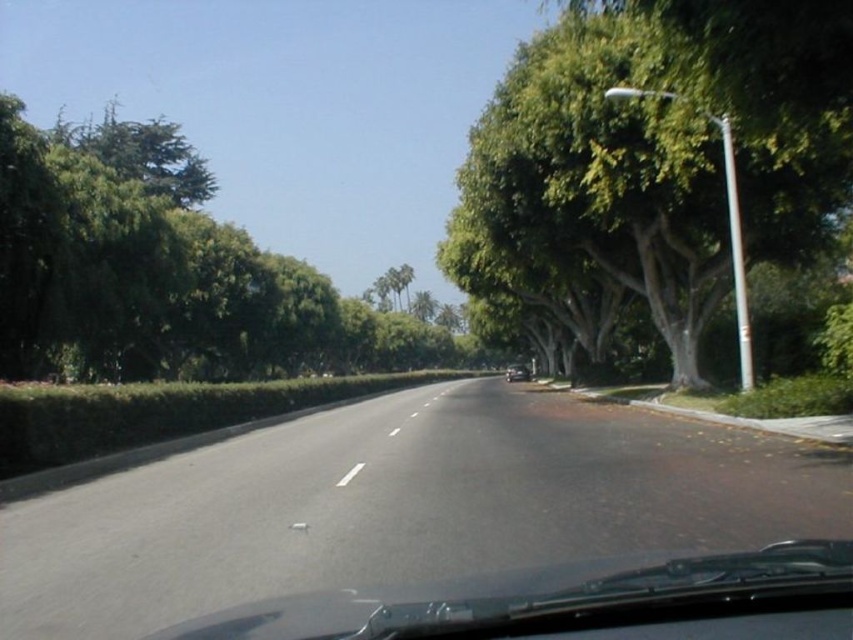
Question: Which point is farther to the camera?

Choices:
 (A) shiny silver car at center
 (B) white glossy line at center
 (C) green leafy tree at right

Answer: (A)

Question: Which of these objects is positioned farthest from the green leafy tree at left?

Choices:
 (A) white glossy line at center
 (B) shiny silver car at center
 (C) green leafy tree at right

Answer: (A)

Question: Does green leafy tree at right lie in front of green leafy tree at left?

Choices:
 (A) no
 (B) yes

Answer: (B)

Question: Can you confirm if green leafy tree at right is positioned to the left of green leafy tree at left?

Choices:
 (A) no
 (B) yes

Answer: (A)

Question: Is green leafy tree at right smaller than white glossy line at center?

Choices:
 (A) no
 (B) yes

Answer: (A)

Question: Which point appears closest to the camera in this image?

Choices:
 (A) (491, 186)
 (B) (341, 480)

Answer: (B)